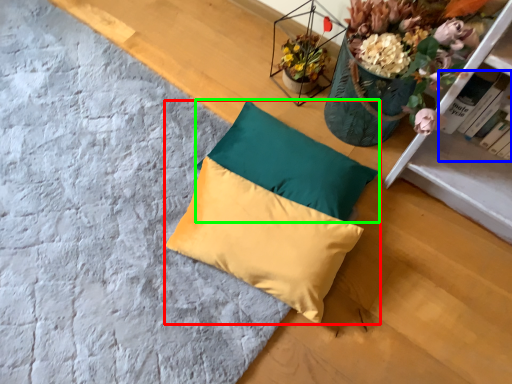
Question: Estimate the real-world distances between objects in this image. Which object is farther from pillow (highlighted by a red box), book (highlighted by a blue box) or pillow (highlighted by a green box)?

Choices:
 (A) book
 (B) pillow

Answer: (A)